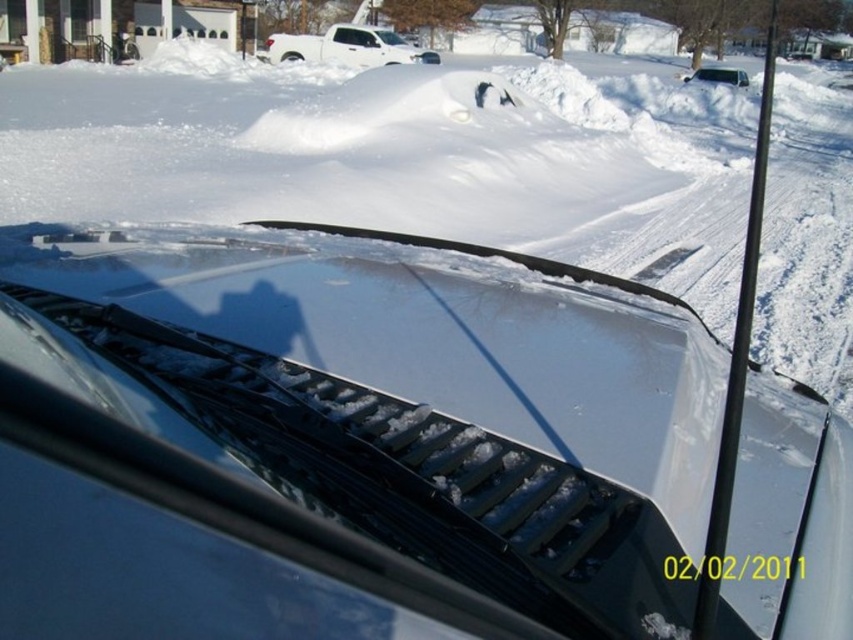
You are a driver who wants to ensure visibility while driving on a snowy day. Considering the sleek silver hood at center and the white fluffy snow at center, which one is lower in height?

The sleek silver hood at center is not as tall as the white fluffy snow at center, so the sleek silver hood at center is lower in height.